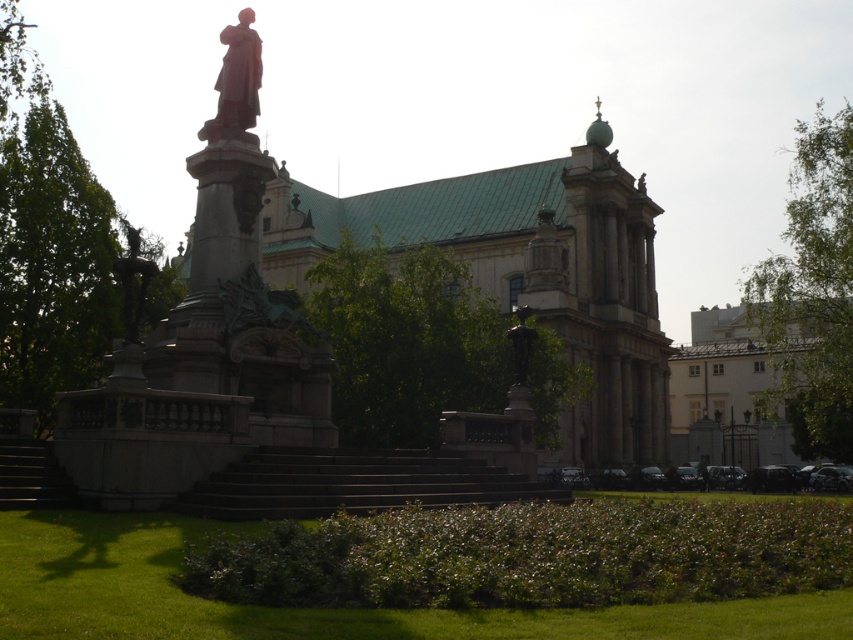
Question: Can you confirm if green leafy tree at upper right is wider than bronze statue at center?

Choices:
 (A) yes
 (B) no

Answer: (A)

Question: Which point is farther to the camera?

Choices:
 (A) (595, 136)
 (B) (421, 403)
 (C) (138, 253)

Answer: (A)

Question: Which object appears farthest from the camera in this image?

Choices:
 (A) green marble spire at upper center
 (B) polished bronze statue at upper center
 (C) polished stone palace at center

Answer: (A)

Question: Does polished stone palace at center appear on the left side of green leafy tree at upper right?

Choices:
 (A) yes
 (B) no

Answer: (A)

Question: Estimate the real-world distances between objects in this image. Which object is farther from the bronze statue at center?

Choices:
 (A) polished stone palace at center
 (B) polished bronze statue at upper center
 (C) green marble spire at upper center
 (D) green leafy tree at upper right

Answer: (D)

Question: Can you confirm if polished bronze statue at upper center is thinner than green marble spire at upper center?

Choices:
 (A) yes
 (B) no

Answer: (A)